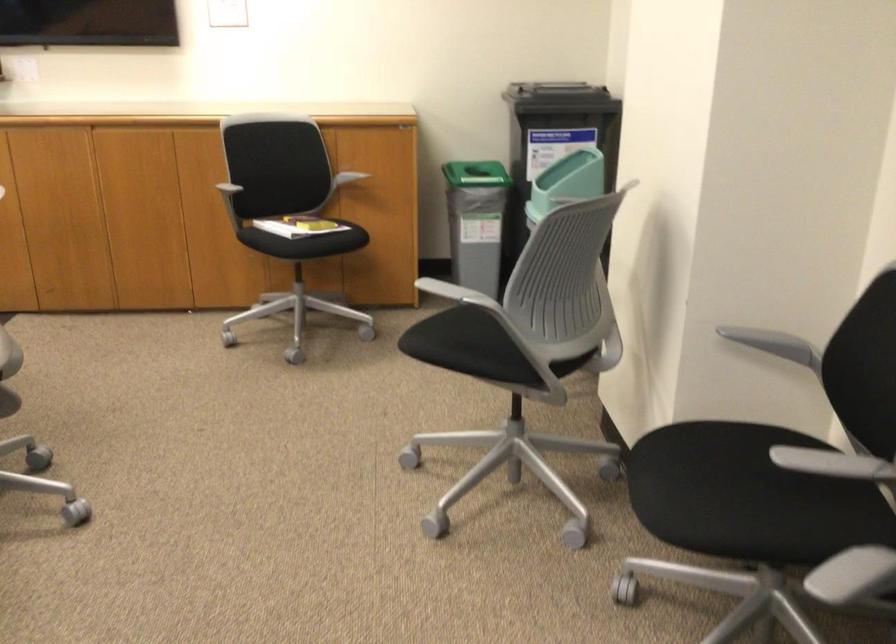
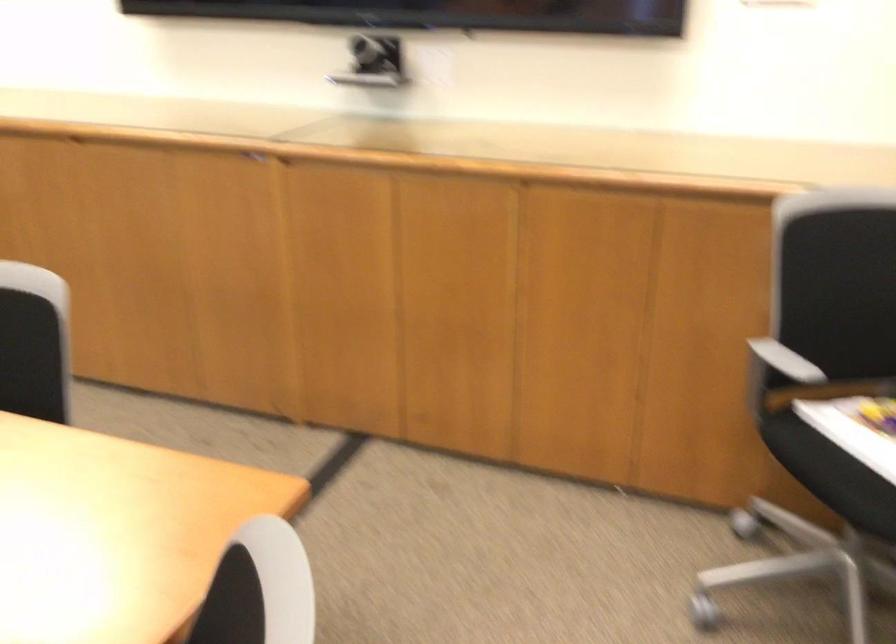
Locate, in the second image, the point that corresponds to pixel 278 225 in the first image.

(857, 442)